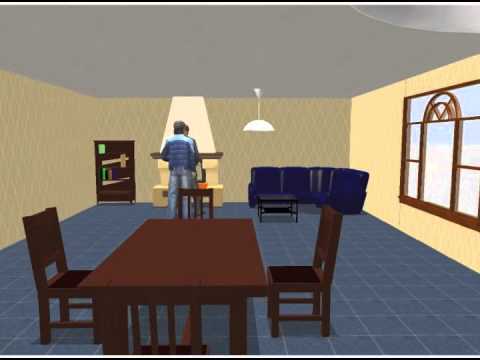
Locate an element on the screen. This screenshot has height=360, width=480. table is located at coordinates (173, 252).